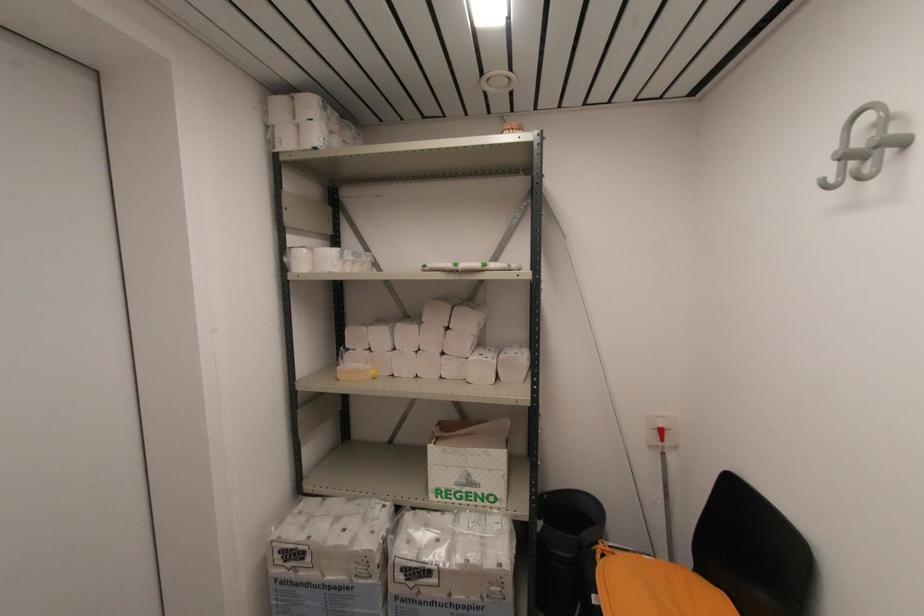
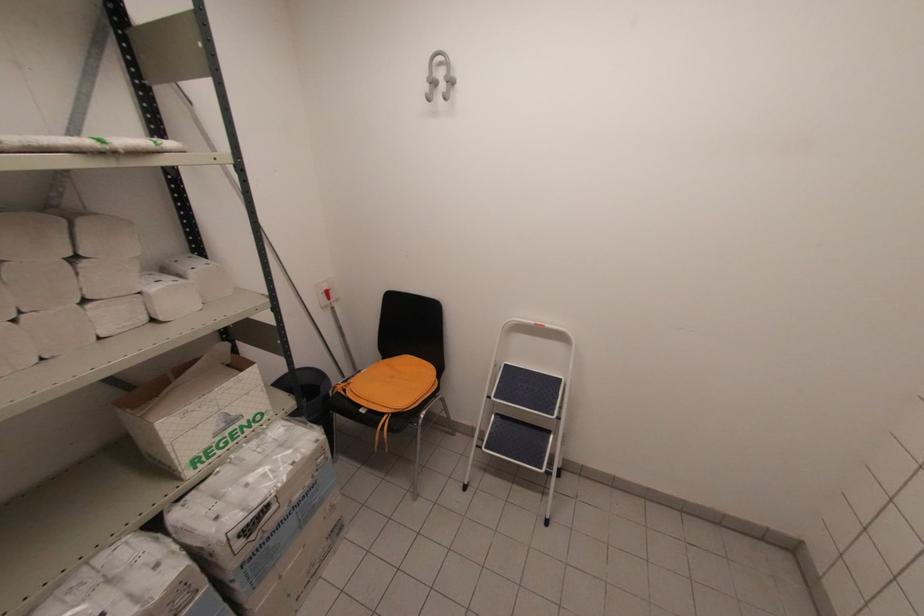
In the second image, find the point that corresponds to point 456,269 in the first image.

(107, 148)